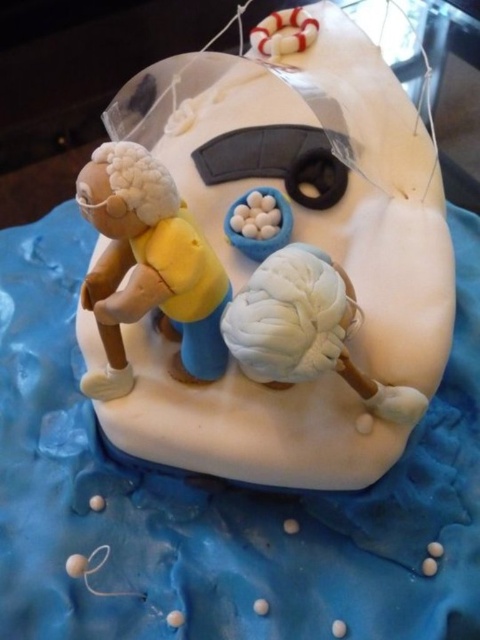
From the picture: You are planning to place a decorative flag on the cake. The flag needs to be placed on the highest point of the cake. Which object between the matte white boat at center and the matte yellow figure at left should the flag be placed on?

The matte white boat at center is located above the matte yellow figure at left, so the flag should be placed on the matte white boat at center as it is the higher point.

Based on the coordinates provided, which figure is located at point (148, 266) on the cake?

The point (148, 266) on the cake marks the location of the matte yellow figure at left.

You are a guest at a birthday party and see the matte white boat at center and the white clay brain at center on the cake. Which one is closer to the left edge of the cake?

The matte white boat at center is closer to the left edge of the cake because it is positioned to the left of the white clay brain at center.